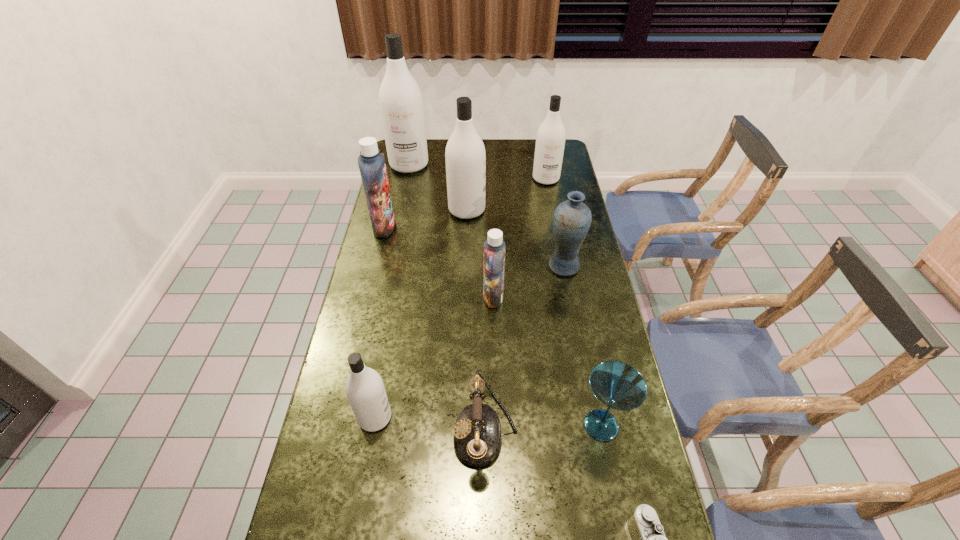
Identify the location of object that is at the far edge. The width and height of the screenshot is (960, 540). (401, 105).

Image resolution: width=960 pixels, height=540 pixels. I want to click on shampoo that is at the right edge, so click(x=550, y=141).

At what (x,y) coordinates should I click in order to perform the action: click on vase positioned at the right edge. Please return your answer as a coordinate pair (x, y). This screenshot has width=960, height=540. Looking at the image, I should click on (571, 222).

The image size is (960, 540). What are the coordinates of `martini located in the right edge section of the desktop` in the screenshot? It's located at (617, 385).

In order to click on object that is at the far left corner in this screenshot , I will do `click(401, 105)`.

You are a GUI agent. You are given a task and a screenshot of the screen. Output one action in this format:
    pyautogui.click(x=<x>, y=<y>)
    Task: Click on the vacant space at the far edge
    This screenshot has height=540, width=960.
    Given the screenshot: What is the action you would take?
    pyautogui.click(x=491, y=163)

Image resolution: width=960 pixels, height=540 pixels. I want to click on free region at the left edge of the desktop, so click(x=376, y=244).

The image size is (960, 540). Identify the location of vacant region at the right edge. (612, 351).

At what (x,y) coordinates should I click in order to perform the action: click on free area in between the right blue shampoo and the rightmost shampoo. Please return your answer as a coordinate pair (x, y). Looking at the image, I should click on (519, 238).

Identify the location of empty space that is in between the second white shampoo from right to left and the farther blue shampoo. The image size is (960, 540). (425, 219).